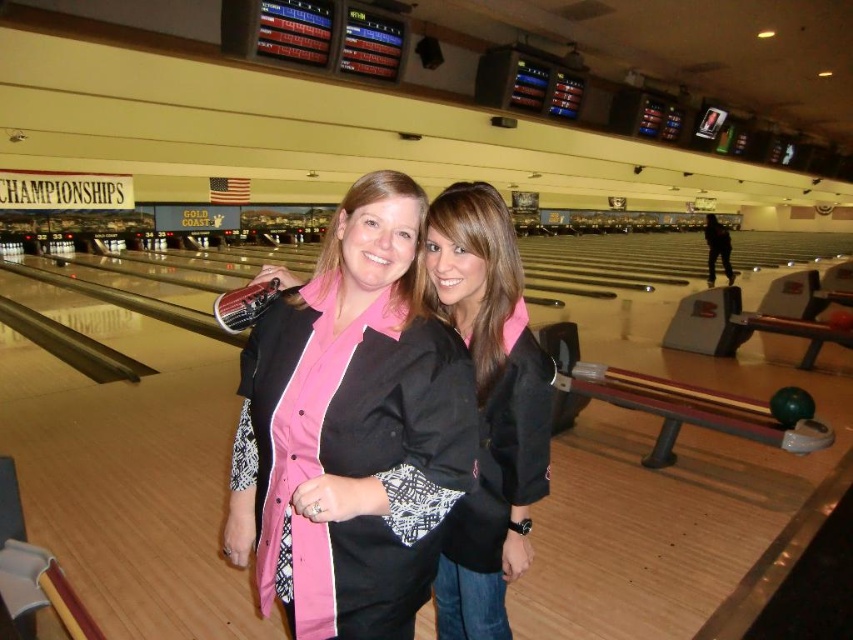
Question: Which of the following is the farthest from the observer?

Choices:
 (A) pink fabric shirt at center
 (B) black matte jacket at center

Answer: (B)

Question: Does pink fabric shirt at center lie in front of black matte jacket at center?

Choices:
 (A) no
 (B) yes

Answer: (B)

Question: Considering the relative positions of pink fabric shirt at center and black matte jacket at center in the image provided, where is pink fabric shirt at center located with respect to black matte jacket at center?

Choices:
 (A) above
 (B) below

Answer: (A)

Question: Is pink fabric shirt at center above black matte jacket at center?

Choices:
 (A) no
 (B) yes

Answer: (B)